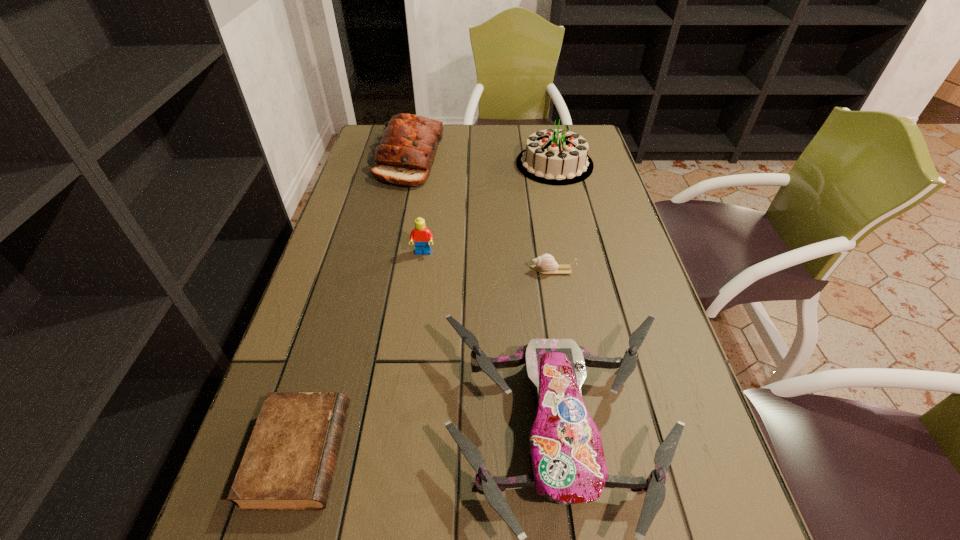
In the image, there is a desktop. Where is `blank space at the left edge`? This screenshot has height=540, width=960. blank space at the left edge is located at coordinates (267, 534).

The width and height of the screenshot is (960, 540). I want to click on vacant area at the right edge of the desktop, so click(x=594, y=279).

The image size is (960, 540). What are the coordinates of `vacant region between the escargot and the bread` in the screenshot? It's located at (482, 214).

Where is `vacant area between the bread and the birthday cake`? This screenshot has width=960, height=540. vacant area between the bread and the birthday cake is located at coordinates (483, 161).

Image resolution: width=960 pixels, height=540 pixels. In order to click on unoccupied area between the diary and the bread in this screenshot , I will do `click(355, 306)`.

At what (x,y) coordinates should I click in order to perform the action: click on vacant area between the diary and the Lego. Please return your answer as a coordinate pair (x, y). Image resolution: width=960 pixels, height=540 pixels. Looking at the image, I should click on (362, 354).

This screenshot has height=540, width=960. In order to click on vacant point located between the tallest object and the fourth nearest object in this screenshot , I will do `click(489, 208)`.

This screenshot has height=540, width=960. I want to click on empty space between the escargot and the diary, so click(426, 362).

I want to click on the closest object to the birthday cake, so click(x=409, y=143).

You are a GUI agent. You are given a task and a screenshot of the screen. Output one action in this format:
    pyautogui.click(x=<x>, y=<y>)
    Task: Click on the object that is the fifth closest to the bread
    This screenshot has height=540, width=960.
    Given the screenshot: What is the action you would take?
    pyautogui.click(x=288, y=465)